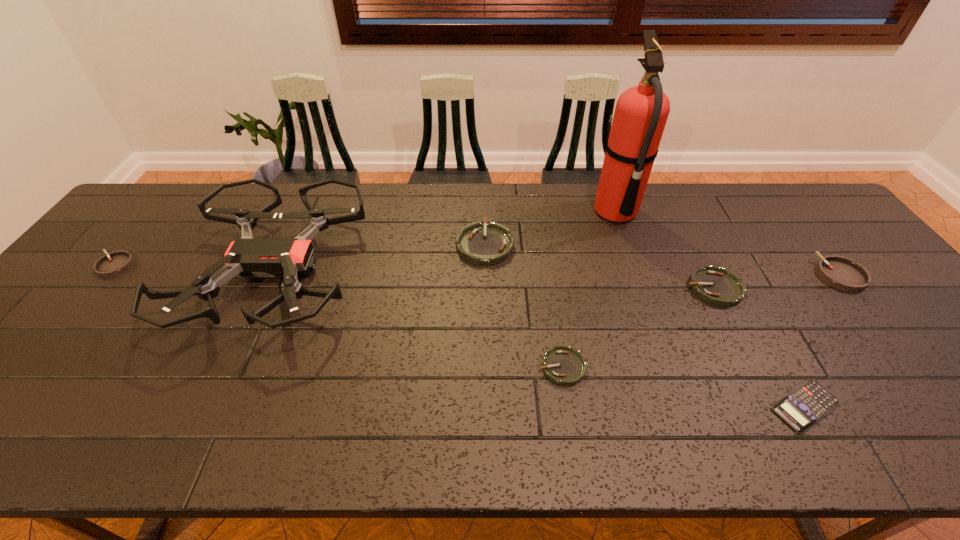
Identify the location of free region located on the left of the bigger gray ashtray. The width and height of the screenshot is (960, 540). (796, 275).

The image size is (960, 540). Identify the location of vacant space located on the right of the biggest green ashtray. (636, 245).

Locate an element on the screen. The width and height of the screenshot is (960, 540). free space located on the back of the left gray ashtray is located at coordinates (154, 219).

Locate an element on the screen. vacant space located on the back of the fourth ashtray from left to right is located at coordinates (679, 218).

Find the location of a particular element. This screenshot has height=540, width=960. vacant space situated 0.310m on the left of the nearest green ashtray is located at coordinates (403, 367).

At what (x,y) coordinates should I click in order to perform the action: click on free location located on the left of the calculator. Please return your answer as a coordinate pair (x, y). The height and width of the screenshot is (540, 960). Looking at the image, I should click on (671, 407).

Where is `fire extinguisher that is positioned at the far edge`? This screenshot has width=960, height=540. fire extinguisher that is positioned at the far edge is located at coordinates (641, 113).

Identify the location of drone situated at the far edge. pos(247,257).

Identify the location of ashtray situated at the far edge. The width and height of the screenshot is (960, 540). (491, 243).

Where is `object at the near edge`? This screenshot has width=960, height=540. object at the near edge is located at coordinates (802, 408).